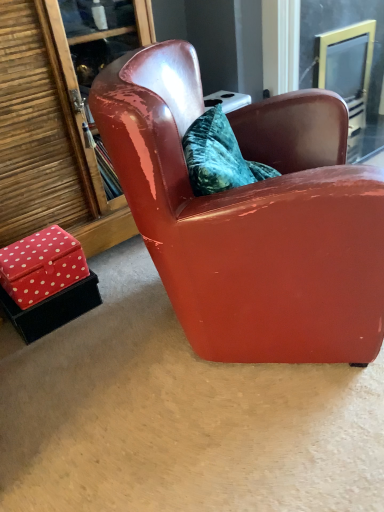
The height and width of the screenshot is (512, 384). Describe the element at coordinates (346, 67) in the screenshot. I see `clear glass screen door at upper right` at that location.

Find the location of a particular element. clear glass screen door at upper right is located at coordinates click(346, 67).

Describe the element at coordinates (52, 309) in the screenshot. This screenshot has width=384, height=512. I see `red polka dot fabric box at lower left, placed as the 2th box when sorted from top to bottom` at that location.

Locate an element on the screen. This screenshot has height=512, width=384. clear glass screen door at upper right is located at coordinates (346, 67).

From a real-world perspective, which object rests below the other?

From a 3D spatial view, red velvet box at lower left, which is counted as the 2th box, starting from the bottom, is below.

Identify the location of screen door above the red velvet box at lower left, which is counted as the 2th box, starting from the bottom (from a real-world perspective). Image resolution: width=384 pixels, height=512 pixels. (346, 67).

Which point is more distant from viewer, [345,64] or [45,260]?

The point [345,64] is more distant.

Does clear glass screen door at upper right have a greater width compared to red velvet box at lower left, which is counted as the 2th box, starting from the bottom?

Correct, the width of clear glass screen door at upper right exceeds that of red velvet box at lower left, which is counted as the 2th box, starting from the bottom.

Is clear glass screen door at upper right outside of glossy leather armchair at center?

Indeed, clear glass screen door at upper right is completely outside glossy leather armchair at center.

From the image's perspective, who appears lower, clear glass screen door at upper right or glossy leather armchair at center?

glossy leather armchair at center is shown below in the image.

Are clear glass screen door at upper right and glossy leather armchair at center far apart?

clear glass screen door at upper right is positioned a significant distance from glossy leather armchair at center.

Is red velvet box at lower left, which is the 1th box in top-to-bottom order, with red polka dot fabric box at lower left, the 1th box ordered from the bottom?

Yes, red velvet box at lower left, which is the 1th box in top-to-bottom order, is next to red polka dot fabric box at lower left, the 1th box ordered from the bottom.

From the picture: Considering the relative sizes of red velvet box at lower left, which is counted as the 2th box, starting from the bottom, and red polka dot fabric box at lower left, placed as the 2th box when sorted from top to bottom, in the image provided, is red velvet box at lower left, which is counted as the 2th box, starting from the bottom, taller than red polka dot fabric box at lower left, placed as the 2th box when sorted from top to bottom,?

Correct, red velvet box at lower left, which is counted as the 2th box, starting from the bottom, is much taller as red polka dot fabric box at lower left, placed as the 2th box when sorted from top to bottom.

I want to click on box located above the red polka dot fabric box at lower left, placed as the 2th box when sorted from top to bottom (from a real-world perspective), so click(41, 266).

In terms of width, does red velvet box at lower left, which is the 1th box in top-to-bottom order, look wider or thinner when compared to red polka dot fabric box at lower left, the 1th box ordered from the bottom?

In the image, red velvet box at lower left, which is the 1th box in top-to-bottom order, appears to be more narrow than red polka dot fabric box at lower left, the 1th box ordered from the bottom.

Considering the sizes of red polka dot fabric box at lower left, placed as the 2th box when sorted from top to bottom, and clear glass screen door at upper right in the image, is red polka dot fabric box at lower left, placed as the 2th box when sorted from top to bottom, bigger or smaller than clear glass screen door at upper right?

Considering their sizes, red polka dot fabric box at lower left, placed as the 2th box when sorted from top to bottom, takes up less space than clear glass screen door at upper right.

From a real-world perspective, is red polka dot fabric box at lower left, the 1th box ordered from the bottom, above or below clear glass screen door at upper right?

Clearly, from a real-world perspective, red polka dot fabric box at lower left, the 1th box ordered from the bottom, is below clear glass screen door at upper right.

Considering the sizes of red polka dot fabric box at lower left, the 1th box ordered from the bottom, and clear glass screen door at upper right in the image, is red polka dot fabric box at lower left, the 1th box ordered from the bottom, taller or shorter than clear glass screen door at upper right?

In the image, red polka dot fabric box at lower left, the 1th box ordered from the bottom, appears to be shorter than clear glass screen door at upper right.

Based on the photo, from a real-world perspective, relative to clear glass screen door at upper right, is red velvet box at lower left, which is counted as the 2th box, starting from the bottom, vertically above or below?

Clearly, from a real-world perspective, red velvet box at lower left, which is counted as the 2th box, starting from the bottom, is below clear glass screen door at upper right.

How far apart are red velvet box at lower left, which is counted as the 2th box, starting from the bottom, and clear glass screen door at upper right?

They are 1.81 meters apart.

Is red velvet box at lower left, which is the 1th box in top-to-bottom order, beside clear glass screen door at upper right?

No, red velvet box at lower left, which is the 1th box in top-to-bottom order, is not making contact with clear glass screen door at upper right.

From the image's perspective, is red velvet box at lower left, which is the 1th box in top-to-bottom order, located above or below clear glass screen door at upper right?

red velvet box at lower left, which is the 1th box in top-to-bottom order, is situated lower than clear glass screen door at upper right in the image.

From a real-world perspective, is glossy leather armchair at center under clear glass screen door at upper right?

Actually, glossy leather armchair at center is physically above clear glass screen door at upper right in the real world.

Does glossy leather armchair at center have a larger size compared to clear glass screen door at upper right?

Indeed, glossy leather armchair at center has a larger size compared to clear glass screen door at upper right.

Is glossy leather armchair at center positioned with its back to clear glass screen door at upper right?

No, glossy leather armchair at center is not facing the opposite direction of clear glass screen door at upper right.

Considering the relative sizes of glossy leather armchair at center and clear glass screen door at upper right in the image provided, is glossy leather armchair at center shorter than clear glass screen door at upper right?

Incorrect, the height of glossy leather armchair at center does not fall short of that of clear glass screen door at upper right.

In the scene shown: Is clear glass screen door at upper right facing away from red polka dot fabric box at lower left, placed as the 2th box when sorted from top to bottom?

clear glass screen door at upper right is not turned away from red polka dot fabric box at lower left, placed as the 2th box when sorted from top to bottom.

What are the coordinates of `screen door above the red polka dot fabric box at lower left, the 1th box ordered from the bottom (from a real-world perspective)` in the screenshot? It's located at (346, 67).

Can you confirm if clear glass screen door at upper right is smaller than red polka dot fabric box at lower left, placed as the 2th box when sorted from top to bottom?

No.

Looking at this image, is clear glass screen door at upper right thinner than red polka dot fabric box at lower left, placed as the 2th box when sorted from top to bottom?

Incorrect, the width of clear glass screen door at upper right is not less than that of red polka dot fabric box at lower left, placed as the 2th box when sorted from top to bottom.

The image size is (384, 512). There is a clear glass screen door at upper right. Identify the location of the 1st box below it (from a real-world perspective). (41, 266).

At what (x,y) coordinates should I click in order to perform the action: click on chair above the clear glass screen door at upper right (from a real-world perspective). Please return your answer as a coordinate pair (x, y). Looking at the image, I should click on tap(250, 217).

When comparing their distances from clear glass screen door at upper right, does glossy leather armchair at center or red velvet box at lower left, which is the 1th box in top-to-bottom order, seem further?

red velvet box at lower left, which is the 1th box in top-to-bottom order, lies further to clear glass screen door at upper right than the other object.

When comparing their distances from red polka dot fabric box at lower left, the 1th box ordered from the bottom, does red velvet box at lower left, which is the 1th box in top-to-bottom order, or clear glass screen door at upper right seem closer?

red velvet box at lower left, which is the 1th box in top-to-bottom order, is closer to red polka dot fabric box at lower left, the 1th box ordered from the bottom.

Based on their spatial positions, is clear glass screen door at upper right or glossy leather armchair at center further from red polka dot fabric box at lower left, the 1th box ordered from the bottom?

clear glass screen door at upper right is positioned further to the anchor red polka dot fabric box at lower left, the 1th box ordered from the bottom.

Looking at the image, which one is located further to red velvet box at lower left, which is counted as the 2th box, starting from the bottom, clear glass screen door at upper right or red polka dot fabric box at lower left, placed as the 2th box when sorted from top to bottom?

Based on the image, clear glass screen door at upper right appears to be further to red velvet box at lower left, which is counted as the 2th box, starting from the bottom.

Which object lies further to the anchor point red velvet box at lower left, which is the 1th box in top-to-bottom order, red polka dot fabric box at lower left, placed as the 2th box when sorted from top to bottom, or clear glass screen door at upper right?

The object further to red velvet box at lower left, which is the 1th box in top-to-bottom order, is clear glass screen door at upper right.

Based on their spatial positions, is glossy leather armchair at center or clear glass screen door at upper right further from red velvet box at lower left, which is counted as the 2th box, starting from the bottom?

Based on the image, clear glass screen door at upper right appears to be further to red velvet box at lower left, which is counted as the 2th box, starting from the bottom.

Which object lies further to the anchor point red polka dot fabric box at lower left, the 1th box ordered from the bottom, glossy leather armchair at center or clear glass screen door at upper right?

clear glass screen door at upper right is positioned further to the anchor red polka dot fabric box at lower left, the 1th box ordered from the bottom.

Estimate the real-world distances between objects in this image. Which object is closer to red velvet box at lower left, which is the 1th box in top-to-bottom order, clear glass screen door at upper right or glossy leather armchair at center?

glossy leather armchair at center is positioned closer to the anchor red velvet box at lower left, which is the 1th box in top-to-bottom order.

Identify the location of box situated between red velvet box at lower left, which is the 1th box in top-to-bottom order, and clear glass screen door at upper right from left to right. The image size is (384, 512). (52, 309).

Where is `box between red velvet box at lower left, which is counted as the 2th box, starting from the bottom, and glossy leather armchair at center`? box between red velvet box at lower left, which is counted as the 2th box, starting from the bottom, and glossy leather armchair at center is located at coordinates (52, 309).